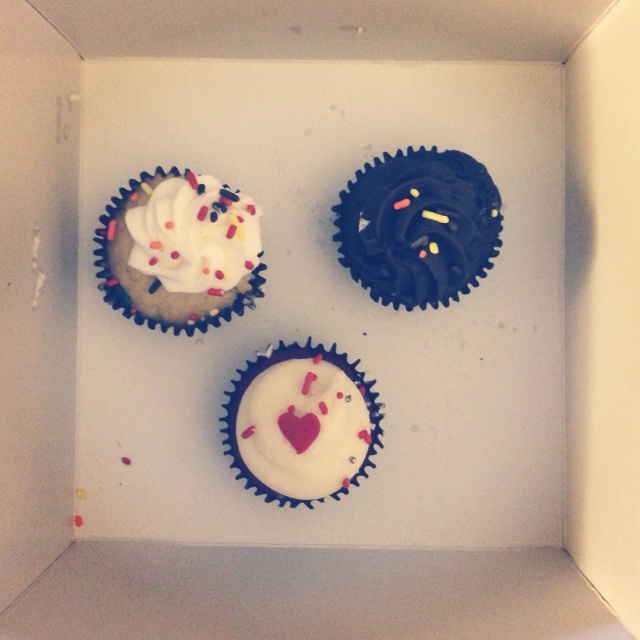
You are looking into the white cardboard box and see the white matte cupcake at upper left and the white matte cupcake at center. Which one is closer to you?

The white matte cupcake at upper left is closer to you because it is in front of the white matte cupcake at center.

In the scene shown: You are looking at the cupcakes in the box. Which of the two points, point 1 at coordinates point (156, 248) or point 2 at coordinates point (400, 225), is closer to you?

Point 1 at coordinates point (156, 248) is closer to you than point 2 at coordinates point (400, 225).

You are standing at the point marked as point (182, 300). There are two cupcakes in the image. Which direction should you move to reach the cupcake that is farther away from your current position?

Since the two cupcakes are 1.22 meters apart, you should move towards the cupcake that is farther away from the point (182, 300). However, without specific information about their exact positions relative to your current location, it is impossible to determine the exact direction to move.